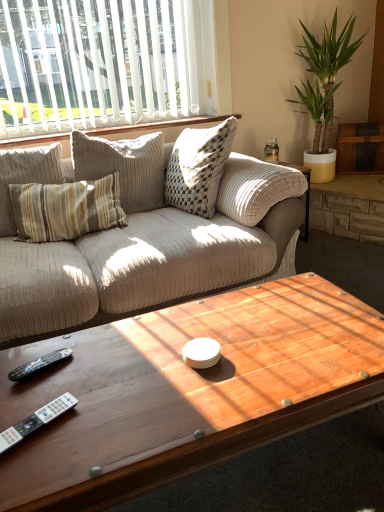
This screenshot has width=384, height=512. What are the coordinates of `free point behind black plastic remote at lower left` in the screenshot? It's located at tap(63, 342).